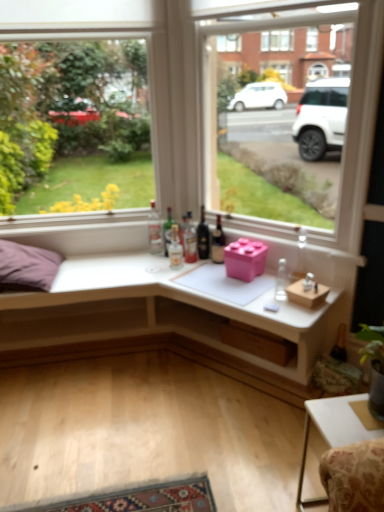
Locate an element on the screen. The width and height of the screenshot is (384, 512). vacant area that lies between clear glass bottle at center, positioned as the 7th bottle in left-to-right order, and pink matte plastic cube at center, positioned as the third window box in bottom-to-top order is located at coordinates (258, 287).